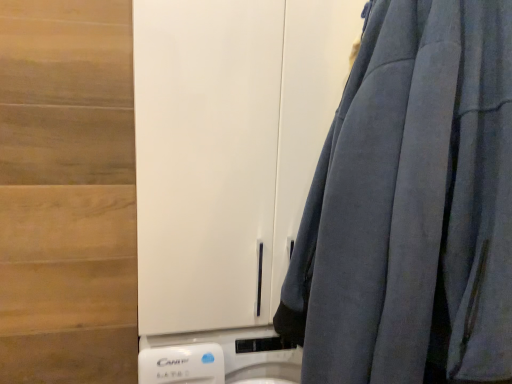
Question: From a real-world perspective, relative to velvet blue curtain at right, is white matte cabinet at center vertically above or below?

Choices:
 (A) below
 (B) above

Answer: (B)

Question: Is white matte cabinet at center wider or thinner than velvet blue curtain at right?

Choices:
 (A) wide
 (B) thin

Answer: (A)

Question: Based on their sizes in the image, would you say white matte cabinet at center is bigger or smaller than velvet blue curtain at right?

Choices:
 (A) big
 (B) small

Answer: (A)

Question: Does point (384, 1) appear closer or farther from the camera than point (136, 71)?

Choices:
 (A) closer
 (B) farther

Answer: (A)

Question: Is velvet blue curtain at right in front of or behind white matte cabinet at center in the image?

Choices:
 (A) behind
 (B) front

Answer: (B)

Question: From a real-world perspective, is velvet blue curtain at right above or below white matte cabinet at center?

Choices:
 (A) above
 (B) below

Answer: (B)

Question: Looking at their shapes, would you say velvet blue curtain at right is wider or thinner than white matte cabinet at center?

Choices:
 (A) wide
 (B) thin

Answer: (B)